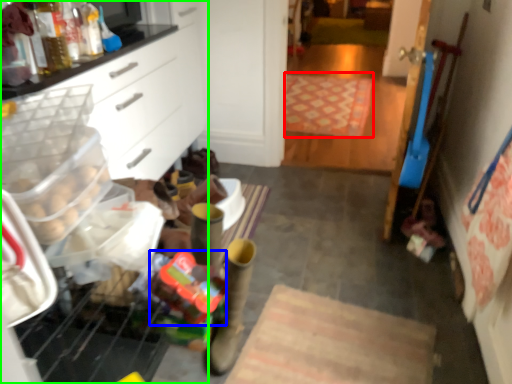
Question: Which is nearer to the mat (highlighted by a red box)? stuff (highlighted by a blue box) or cabinetry (highlighted by a green box).

Choices:
 (A) stuff
 (B) cabinetry

Answer: (B)